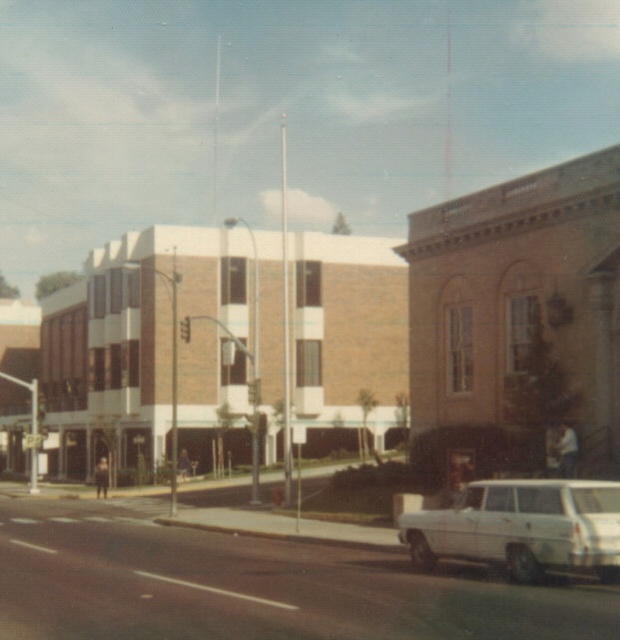
Does brick building at center have a larger size compared to white matte station wagon at lower right?

Correct, brick building at center is larger in size than white matte station wagon at lower right.

Does brick building at center appear over white matte station wagon at lower right?

Correct, brick building at center is located above white matte station wagon at lower right.

Measure the distance between point (525, 240) and camera.

27.20 meters

What are the coordinates of `brick building at center` in the screenshot? It's located at (466, 323).